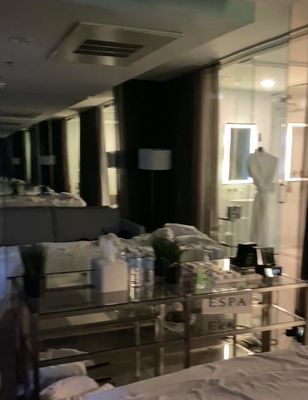
This screenshot has width=308, height=400. Identify the location of lamp. (150, 155).